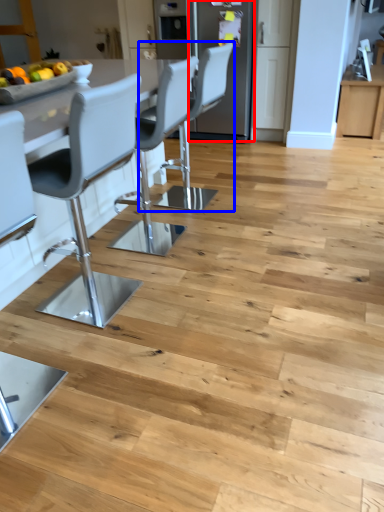
Question: Which object appears closest to the camera in this image, appliance (highlighted by a red box) or chair (highlighted by a blue box)?

Choices:
 (A) appliance
 (B) chair

Answer: (B)